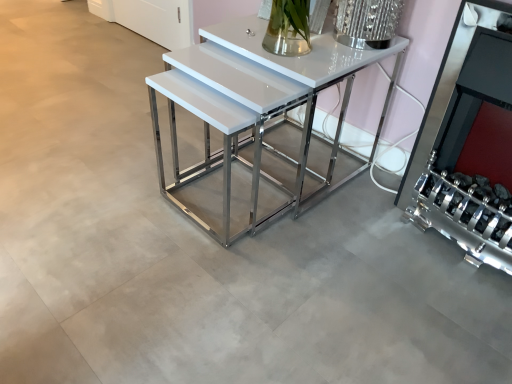
Question: From their relative heights in the image, would you say white glossy table at center is taller or shorter than silver metallic fireplace at right?

Choices:
 (A) short
 (B) tall

Answer: (A)

Question: Is white glossy table at center bigger or smaller than silver metallic fireplace at right?

Choices:
 (A) small
 (B) big

Answer: (B)

Question: Considering the positions of white glossy table at center and silver metallic fireplace at right in the image, is white glossy table at center wider or thinner than silver metallic fireplace at right?

Choices:
 (A) wide
 (B) thin

Answer: (A)

Question: Considering the positions of silver metallic fireplace at right and white glossy table at center in the image, is silver metallic fireplace at right bigger or smaller than white glossy table at center?

Choices:
 (A) big
 (B) small

Answer: (B)

Question: In terms of height, does silver metallic fireplace at right look taller or shorter compared to white glossy table at center?

Choices:
 (A) short
 (B) tall

Answer: (B)

Question: Is silver metallic fireplace at right situated inside white glossy table at center or outside?

Choices:
 (A) inside
 (B) outside

Answer: (B)

Question: From the image's perspective, is silver metallic fireplace at right positioned above or below white glossy table at center?

Choices:
 (A) below
 (B) above

Answer: (A)